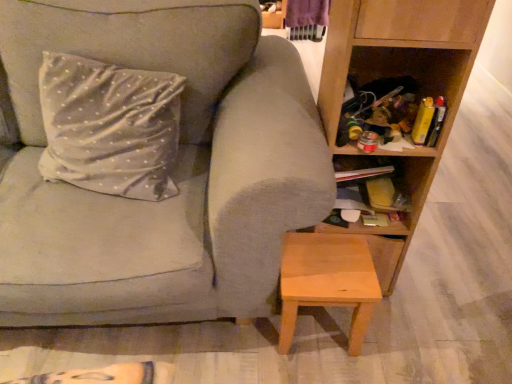
Question: Should I look upward or downward to see matte gray couch at center?

Choices:
 (A) down
 (B) up

Answer: (B)

Question: Does wooden cabinet at lower right have a lesser height compared to silky silver pillow at upper left?

Choices:
 (A) no
 (B) yes

Answer: (B)

Question: Is wooden cabinet at lower right positioned with its back to silky silver pillow at upper left?

Choices:
 (A) yes
 (B) no

Answer: (B)

Question: Considering the relative sizes of wooden cabinet at lower right and silky silver pillow at upper left in the image provided, is wooden cabinet at lower right wider than silky silver pillow at upper left?

Choices:
 (A) yes
 (B) no

Answer: (A)

Question: Is wooden cabinet at lower right surrounding silky silver pillow at upper left?

Choices:
 (A) no
 (B) yes

Answer: (A)

Question: Is wooden cabinet at lower right thinner than silky silver pillow at upper left?

Choices:
 (A) no
 (B) yes

Answer: (A)

Question: From a real-world perspective, is wooden cabinet at lower right positioned over silky silver pillow at upper left based on gravity?

Choices:
 (A) yes
 (B) no

Answer: (B)

Question: Is silky silver pillow at upper left not close to light brown wooden stool at lower center?

Choices:
 (A) yes
 (B) no

Answer: (B)

Question: Is silky silver pillow at upper left wider than light brown wooden stool at lower center?

Choices:
 (A) yes
 (B) no

Answer: (B)

Question: Is silky silver pillow at upper left looking in the opposite direction of light brown wooden stool at lower center?

Choices:
 (A) no
 (B) yes

Answer: (A)

Question: Considering the relative sizes of silky silver pillow at upper left and light brown wooden stool at lower center in the image provided, is silky silver pillow at upper left thinner than light brown wooden stool at lower center?

Choices:
 (A) no
 (B) yes

Answer: (B)

Question: Is silky silver pillow at upper left positioned in front of light brown wooden stool at lower center?

Choices:
 (A) yes
 (B) no

Answer: (A)

Question: Is silky silver pillow at upper left facing towards light brown wooden stool at lower center?

Choices:
 (A) yes
 (B) no

Answer: (B)

Question: Can you confirm if light brown wooden stool at lower center is positioned to the right of wooden cabinet at lower right?

Choices:
 (A) yes
 (B) no

Answer: (B)